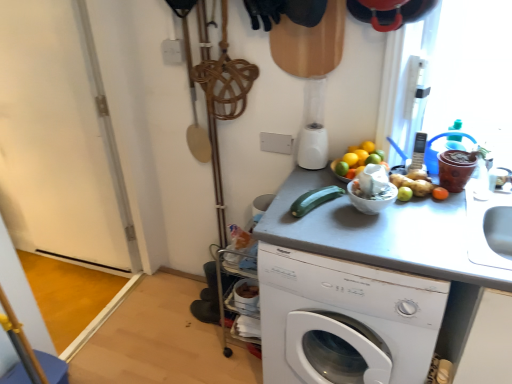
This screenshot has height=384, width=512. I want to click on free spot in front of green matte cucumber at center, so click(330, 232).